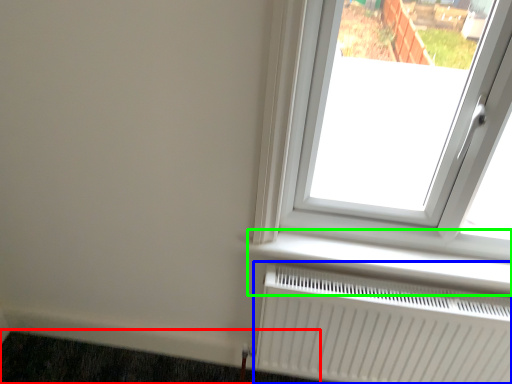
Question: Estimate the real-world distances between objects in this image. Which object is closer to doormat (highlighted by a red box), radiator (highlighted by a blue box) or window sill (highlighted by a green box)?

Choices:
 (A) radiator
 (B) window sill

Answer: (A)